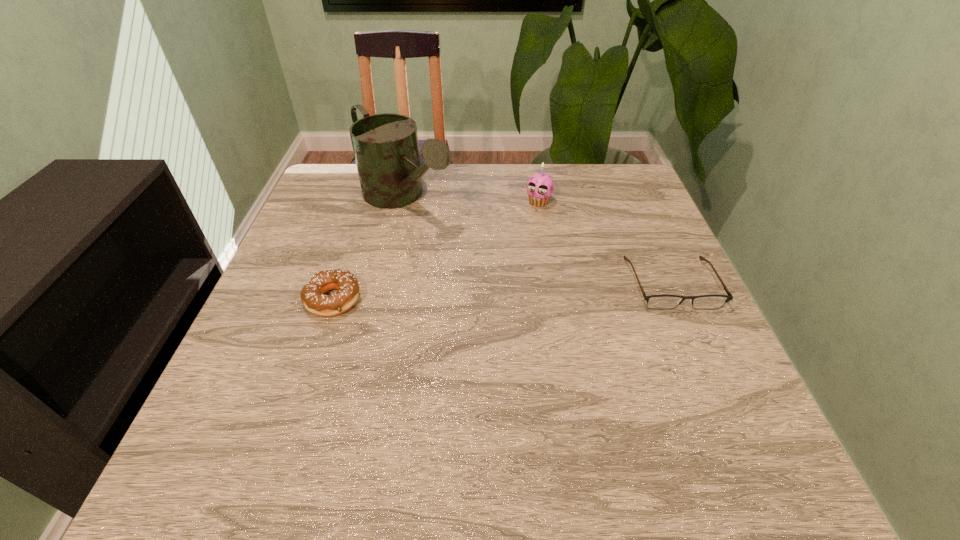
This screenshot has height=540, width=960. In order to click on vacant position located with the spout on the tallest object in this screenshot , I will do `click(448, 239)`.

I want to click on free space located on the face of the cupcake, so click(524, 226).

Find the location of `free point located on the face of the cupcake`. free point located on the face of the cupcake is located at coordinates (485, 290).

Where is `free spot located 0.080m on the face of the cupcake`? The width and height of the screenshot is (960, 540). free spot located 0.080m on the face of the cupcake is located at coordinates (524, 226).

This screenshot has width=960, height=540. Find the location of `watering can present at the far edge`. watering can present at the far edge is located at coordinates (385, 146).

The width and height of the screenshot is (960, 540). I want to click on cupcake located at the far edge, so click(x=540, y=186).

At what (x,y) coordinates should I click in order to perform the action: click on doughnut situated at the left edge. Please return your answer as a coordinate pair (x, y). Looking at the image, I should click on (312, 296).

Locate an element on the screen. The image size is (960, 540). watering can that is at the left edge is located at coordinates (385, 146).

Identify the location of object located in the right edge section of the desktop. (661, 302).

In order to click on object present at the far left corner in this screenshot , I will do `click(385, 146)`.